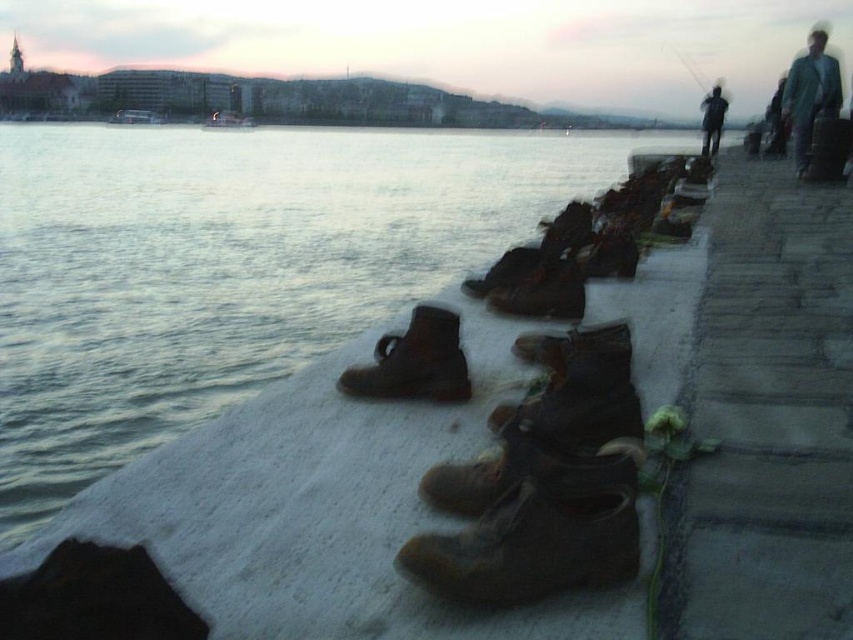
Is smooth water at center to the left of metallic fishing pole at upper right from the viewer's perspective?

Correct, you'll find smooth water at center to the left of metallic fishing pole at upper right.

Is point (456, 134) positioned after point (698, 77)?

No, (456, 134) is in front of (698, 77).

Is point (270, 330) positioned after point (703, 88)?

No, (270, 330) is closer to viewer.

You are a GUI agent. You are given a task and a screenshot of the screen. Output one action in this format:
    pyautogui.click(x=<x>, y=<y>)
    Task: Click on the smooth water at center
    
    Given the screenshot: What is the action you would take?
    pyautogui.click(x=231, y=268)

Who is more forward, (386, 392) or (708, 106)?

Point (386, 392)

Is leather boot at center thinner than dark blue jeans at upper right?

Yes.

At what (x,y) coordinates should I click in order to perform the action: click on leather boot at center. Please return your answer as a coordinate pair (x, y). The height and width of the screenshot is (640, 853). Looking at the image, I should click on (415, 362).

Find the location of `leather boot at center`. leather boot at center is located at coordinates (415, 362).

Can you confirm if smooth water at center is positioned to the left of leather boot at center?

Correct, you'll find smooth water at center to the left of leather boot at center.

Is point (212, 138) positioned after point (430, 394)?

Yes, point (212, 138) is behind point (430, 394).

Is point (450, 220) positioned before point (437, 381)?

No, (450, 220) is further to viewer.

Identify the location of smooth water at center. The width and height of the screenshot is (853, 640). (231, 268).